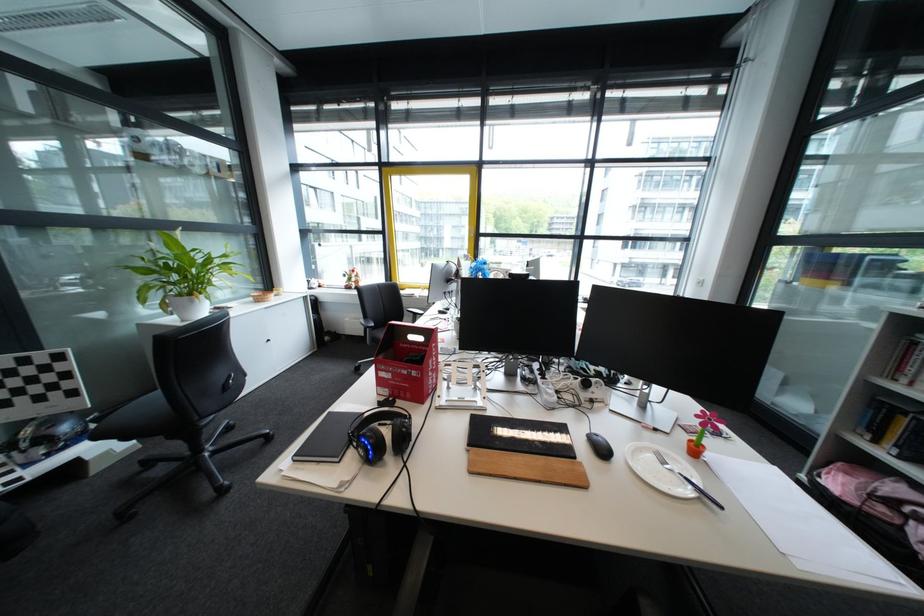
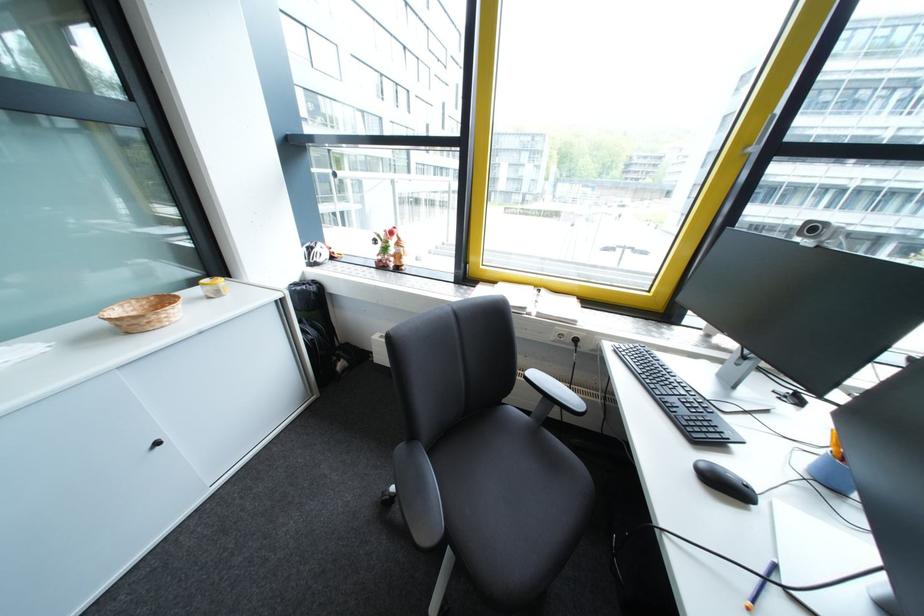
Which direction would the cameraman need to move to produce the second image?

The movement direction of the cameraman is left, forward.